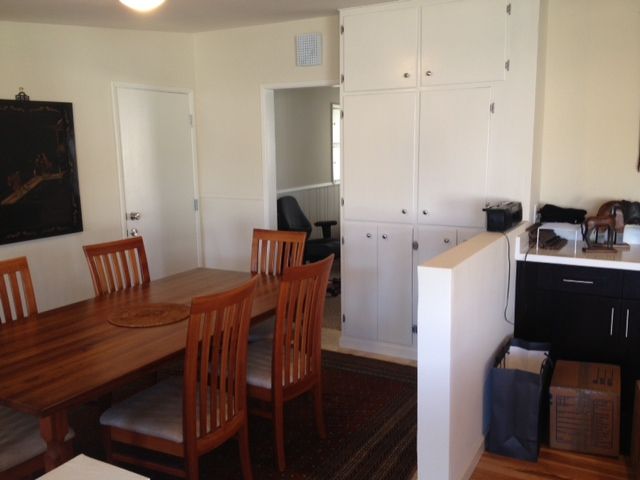
Where is `white cabinets`? This screenshot has height=480, width=640. white cabinets is located at coordinates (380, 27), (465, 50), (372, 188), (445, 177), (465, 233), (434, 245), (385, 249), (354, 256).